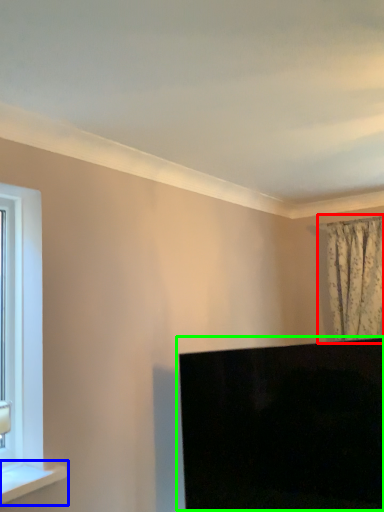
Question: Which object is the closest to the curtain (highlighted by a red box)? Choose among these: window sill (highlighted by a blue box) or computer monitor (highlighted by a green box).

Choices:
 (A) window sill
 (B) computer monitor

Answer: (B)